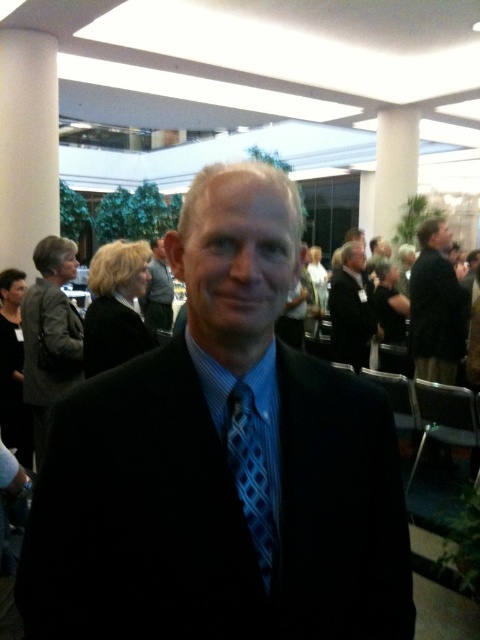
Question: Can you confirm if dark gray suit at left is positioned above black suit at right?

Choices:
 (A) no
 (B) yes

Answer: (A)

Question: Is blue woven tie at center bigger than black suit at center?

Choices:
 (A) yes
 (B) no

Answer: (B)

Question: Does dark gray suit at left appear under black wool suit at left?

Choices:
 (A) no
 (B) yes

Answer: (B)

Question: Estimate the real-world distances between objects in this image. Which object is farther from the black suit at right?

Choices:
 (A) black silk suit at center
 (B) blue woven tie at center
 (C) black suit at center

Answer: (B)

Question: Which point is closer to the camera?

Choices:
 (A) black silk suit at center
 (B) dark gray suit at left

Answer: (A)

Question: Considering the real-world distances, which object is farthest from the black silk suit at center?

Choices:
 (A) black suit at right
 (B) dark gray suit at left

Answer: (A)